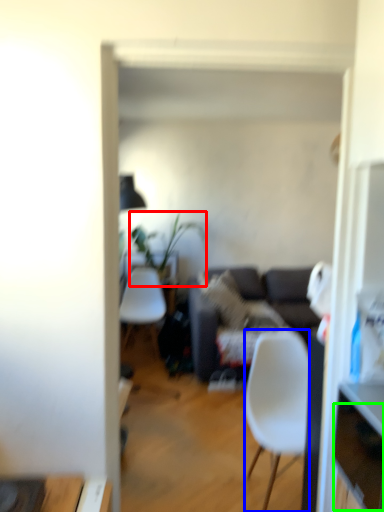
Question: Estimate the real-world distances between objects in this image. Which object is farther from houseplant (highlighted by a red box), chair (highlighted by a blue box) or drawer (highlighted by a green box)?

Choices:
 (A) chair
 (B) drawer

Answer: (B)